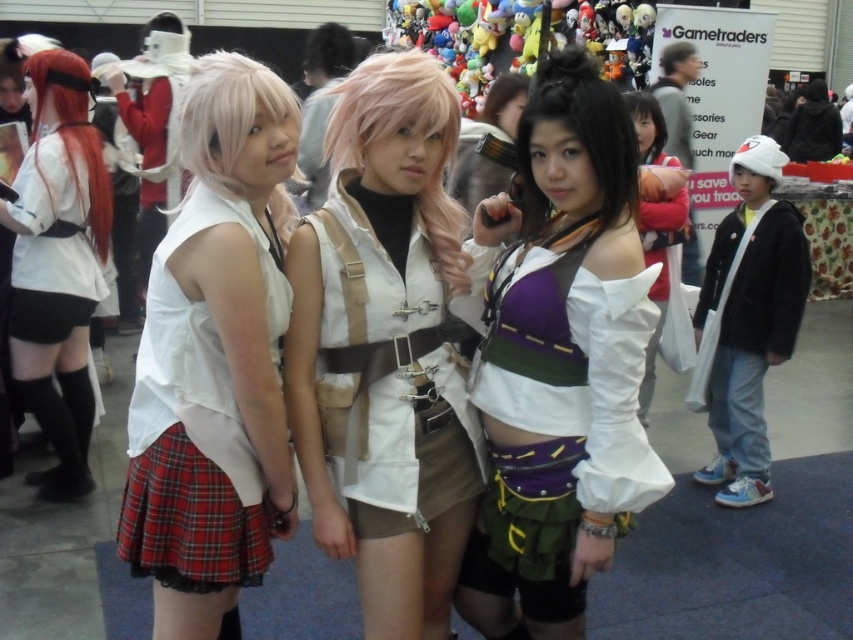
Looking at this image, in the convention scene, there is a shiny red wig at left. Where exactly is it located in terms of coordinates?

The shiny red wig at left is located at point (74, 131).

You are a photographer at the event and need to adjust the camera focus. The matte white skirt at left and the pink synthetic wig at center are both in the frame. Which object should you focus on first if you want to ensure the taller one is sharp?

The matte white skirt at left is taller than the pink synthetic wig at center, so you should focus on the matte white skirt at left first to ensure it is sharp.

You are standing in the convention hall and want to locate the purple fabric top at center. Based on the coordinate system where the bottom left corner is the origin, can you determine its location?

The purple fabric top at center is located at coordinates approximately 0.569 on the x axis and 0.658 on the y axis.